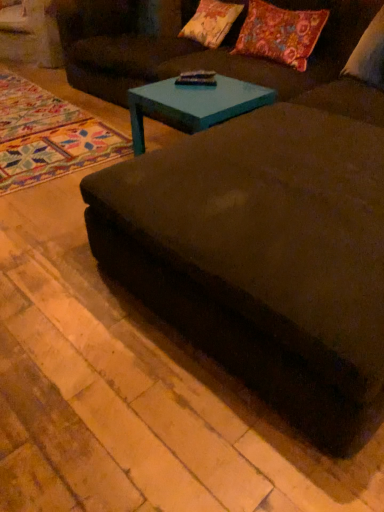
Question: From the image's perspective, relative to floral fabric pillow at upper center, marked as the 3th pillow in a right-to-left arrangement, is white soft pillow at upper right, acting as the first pillow starting from the right, above or below?

Choices:
 (A) below
 (B) above

Answer: (A)

Question: Considering the positions of white soft pillow at upper right, acting as the first pillow starting from the right, and floral fabric pillow at upper center, marked as the 3th pillow in a right-to-left arrangement, in the image, is white soft pillow at upper right, acting as the first pillow starting from the right, taller or shorter than floral fabric pillow at upper center, marked as the 3th pillow in a right-to-left arrangement,?

Choices:
 (A) short
 (B) tall

Answer: (B)

Question: Considering the real-world distances, which object is farthest from the white soft pillow at upper right, which appears as the 3th pillow when viewed from the left?

Choices:
 (A) floral fabric pillow at upper right, which is the second pillow in right-to-left order
 (B) teal glossy coffee table at center
 (C) multicolored woven rug at lower left
 (D) dark brown fabric couch at center
 (E) floral fabric pillow at upper center, which appears as the 1th pillow when viewed from the left

Answer: (C)

Question: Which is farther from the floral fabric pillow at upper right, which is the second pillow in right-to-left order?

Choices:
 (A) velvet dark brown couch at center
 (B) white soft pillow at upper right, acting as the first pillow starting from the right
 (C) dark brown fabric couch at center
 (D) teal glossy coffee table at center
 (E) multicolored woven rug at lower left

Answer: (A)